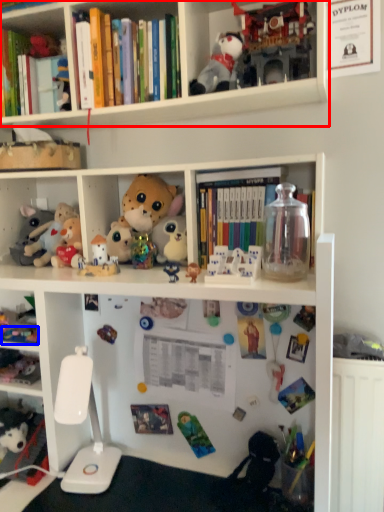
Question: Which of the following is the closest to the observer, shelf (highlighted by a red box) or toy (highlighted by a blue box)?

Choices:
 (A) shelf
 (B) toy

Answer: (A)